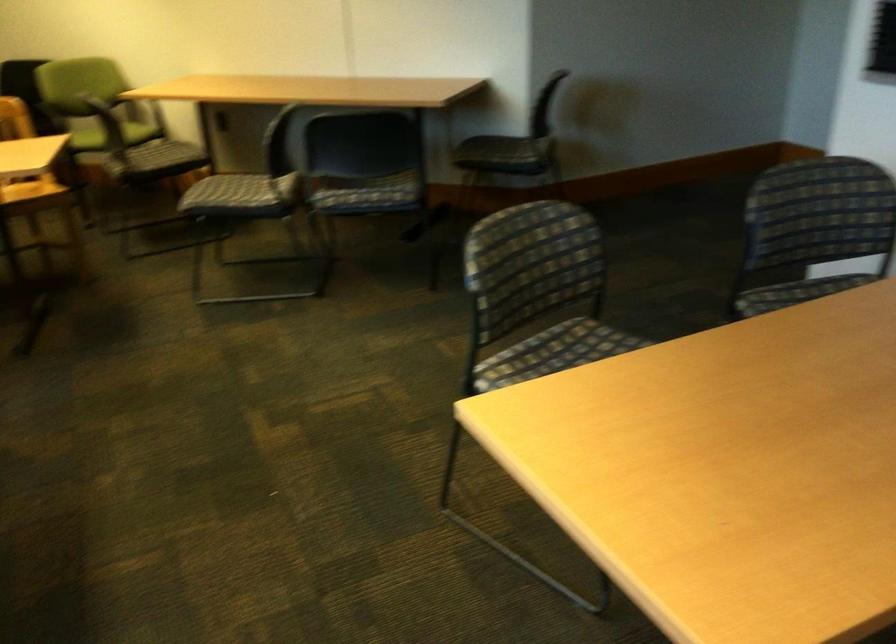
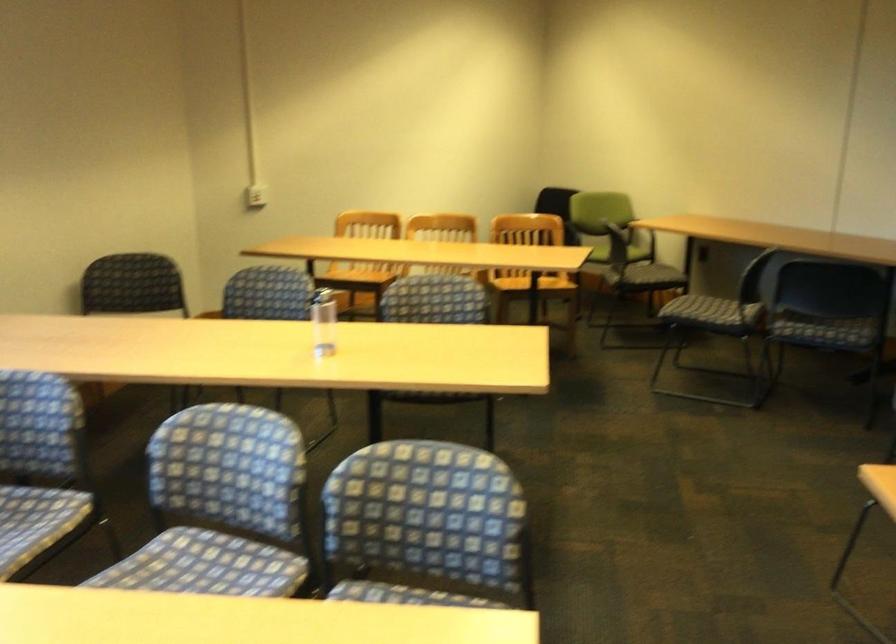
Find the pixel in the second image that matches [238,205] in the first image.

(710, 310)